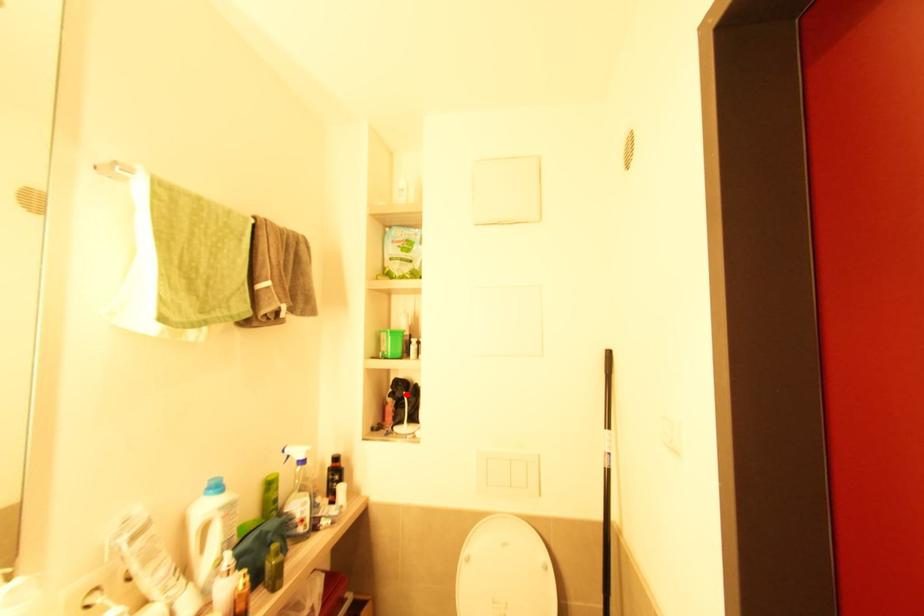
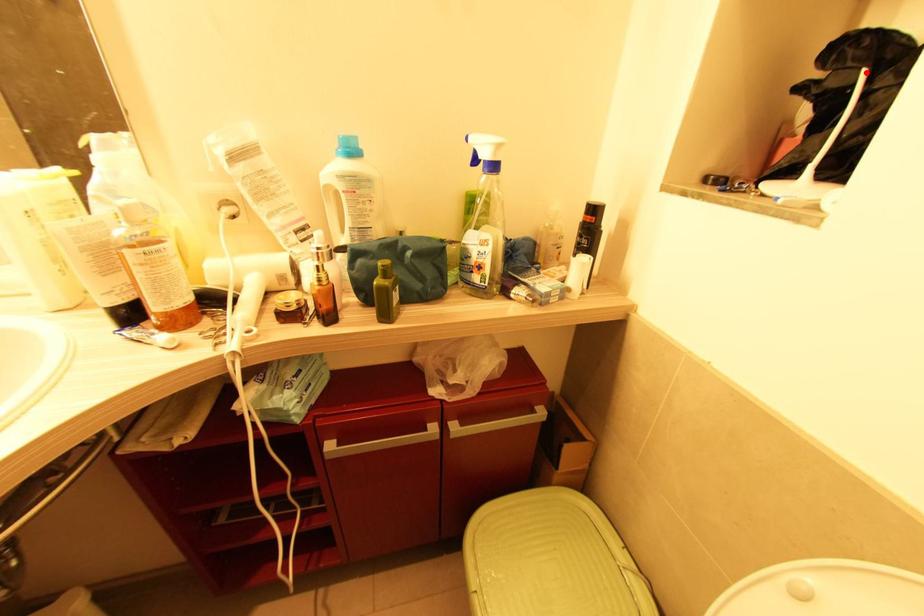
I am providing you with two images of the same scene from different viewpoints. A red point is marked on the first image and another point is marked on the second image. Is the marked point in image1 the same physical position as the marked point in image2?

Yes